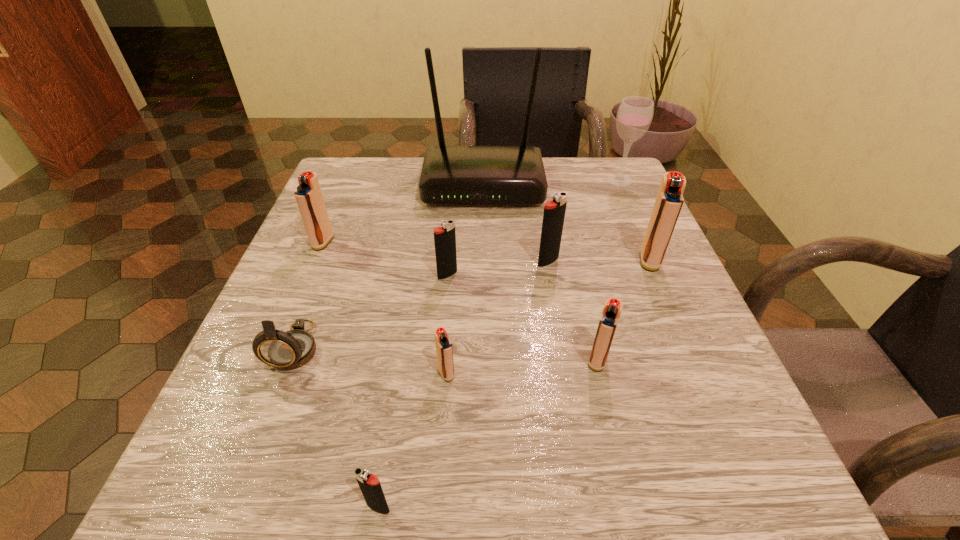
The height and width of the screenshot is (540, 960). In order to click on vacant area at the near right corner of the desktop in this screenshot , I will do point(681,501).

The height and width of the screenshot is (540, 960). Identify the location of vacant region between the leftmost red igniter and the wineglass. (471, 211).

Image resolution: width=960 pixels, height=540 pixels. In order to click on free space between the rightmost igniter and the rightmost black igniter in this screenshot , I will do `click(599, 261)`.

Locate an element on the screen. Image resolution: width=960 pixels, height=540 pixels. unoccupied position between the router and the eighth object from left to right is located at coordinates (540, 272).

Where is `vacant area that lies between the wineglass and the third biggest red igniter`? The image size is (960, 540). vacant area that lies between the wineglass and the third biggest red igniter is located at coordinates (609, 271).

Identify the location of blank region between the second red igniter from left to right and the leftmost igniter. The width and height of the screenshot is (960, 540). (385, 308).

The height and width of the screenshot is (540, 960). In order to click on vacant point located between the second red igniter from left to right and the nearest black igniter in this screenshot , I will do `click(412, 440)`.

The height and width of the screenshot is (540, 960). Identify the location of free space between the biggest red igniter and the compass. (473, 303).

You are a GUI agent. You are given a task and a screenshot of the screen. Output one action in this format:
    pyautogui.click(x=<x>, y=<y>)
    Task: Click on the vacant area that lies between the compass and the smallest red igniter
    This screenshot has height=540, width=960.
    Given the screenshot: What is the action you would take?
    pyautogui.click(x=372, y=360)

You are a GUI agent. You are given a task and a screenshot of the screen. Output one action in this format:
    pyautogui.click(x=<x>, y=<y>)
    Task: Click on the vacant space in between the wineglass and the third red igniter from right to left
    This screenshot has width=960, height=540.
    Given the screenshot: What is the action you would take?
    pyautogui.click(x=533, y=276)